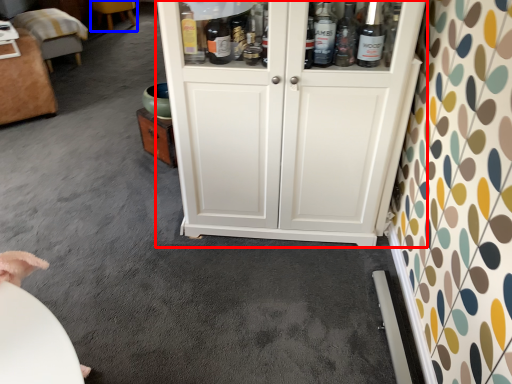
Question: Among these objects, which one is nearest to the camera, cupboard (highlighted by a red box) or furniture (highlighted by a blue box)?

Choices:
 (A) cupboard
 (B) furniture

Answer: (A)